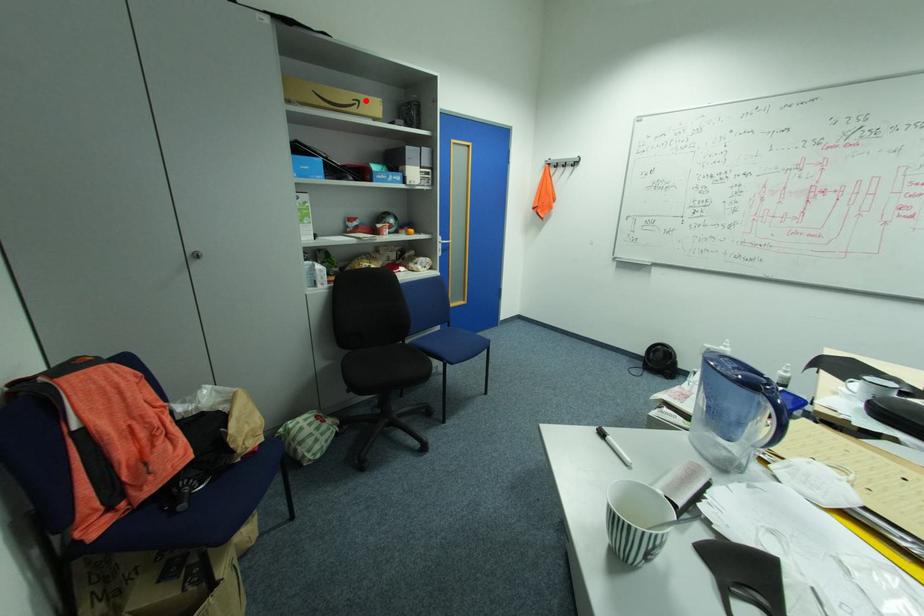
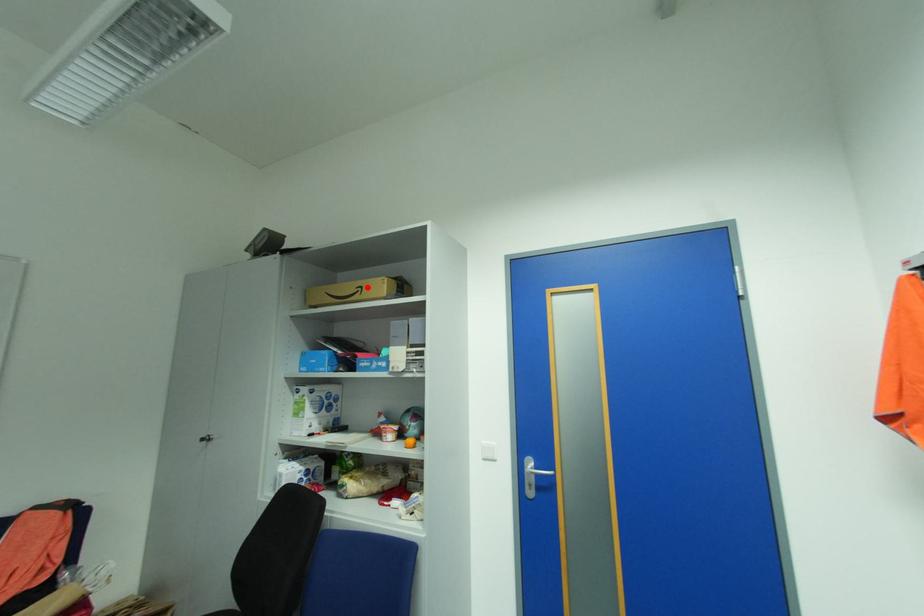
I am providing you with two images of the same scene from different viewpoints. A red point is marked on the first image and another point is marked on the second image. Do the highlighted points in image1 and image2 indicate the same real-world spot?

Yes